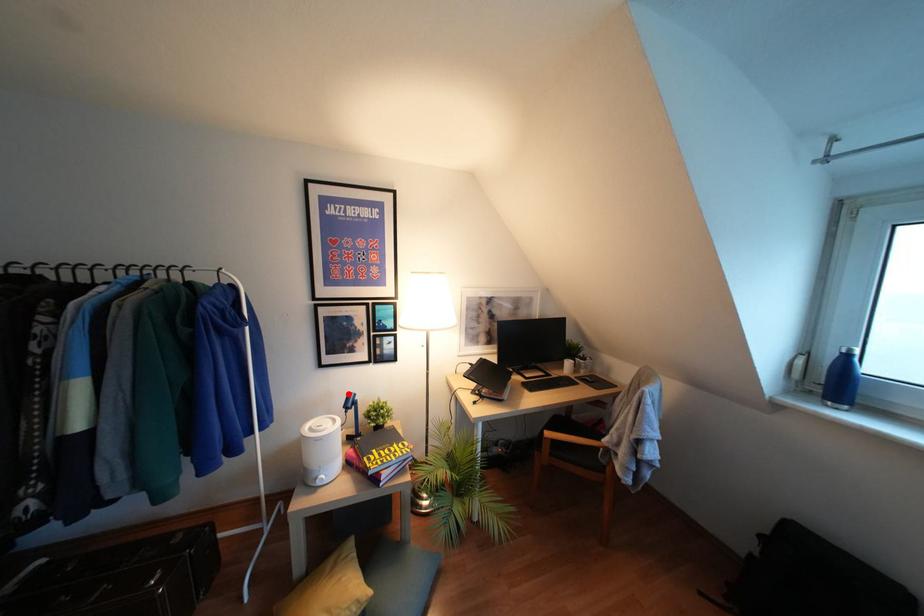
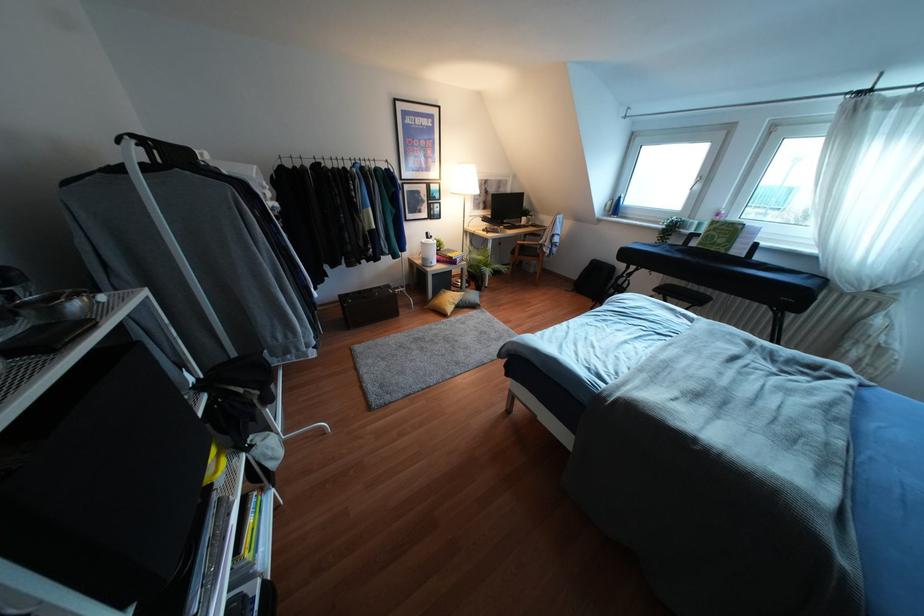
Locate, in the second image, the point that corresponds to the highlighted location in the first image.

(427, 233)